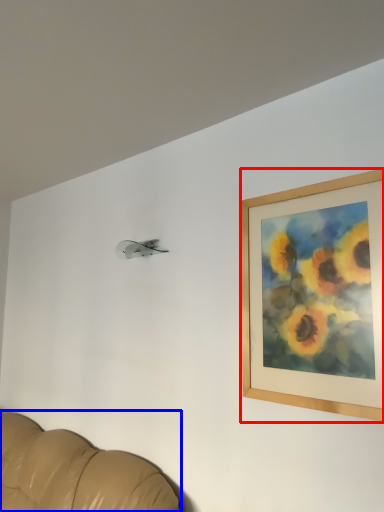
Question: Which object appears closest to the camera in this image, picture frame (highlighted by a red box) or furniture (highlighted by a blue box)?

Choices:
 (A) picture frame
 (B) furniture

Answer: (B)